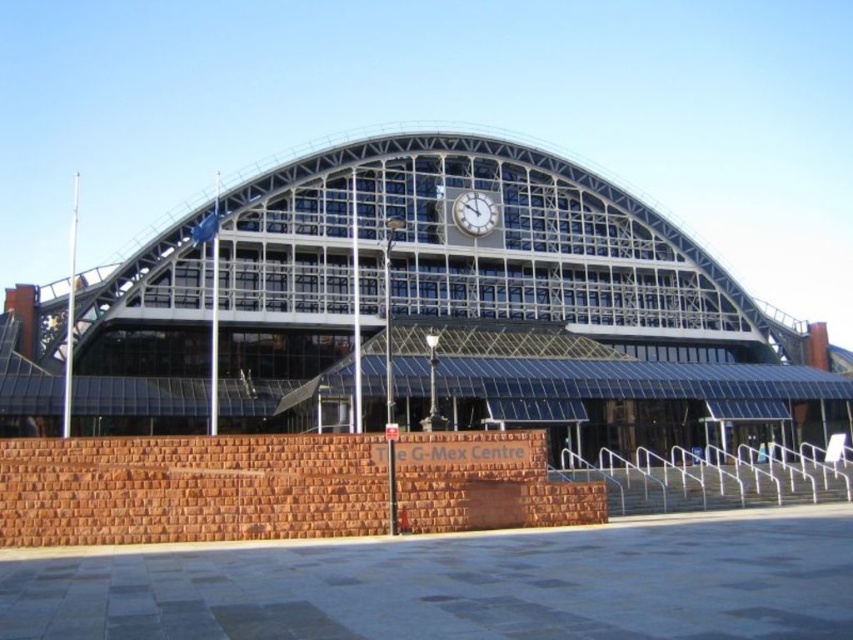
Which is below, glassy steel railway station at center or white metallic clock at center?

Positioned lower is glassy steel railway station at center.

Does glassy steel railway station at center appear under white metallic clock at center?

Correct, glassy steel railway station at center is located below white metallic clock at center.

Is point (288, 170) farther from camera compared to point (468, 212)?

No, it is in front of (468, 212).

At what (x,y) coordinates should I click in order to perform the action: click on glassy steel railway station at center. Please return your answer as a coordinate pair (x, y). The width and height of the screenshot is (853, 640). Looking at the image, I should click on (445, 312).